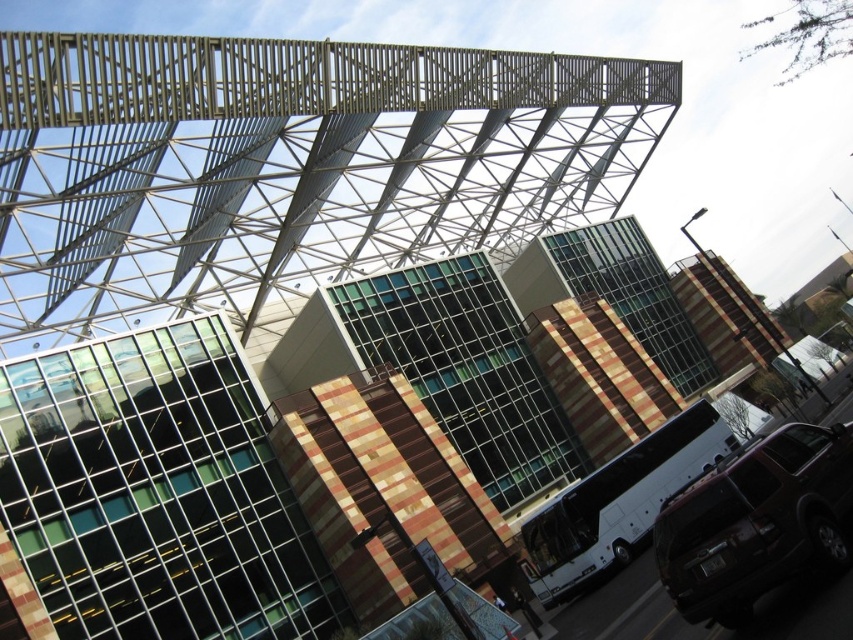
You are a city planner evaluating the parking space requirements for the shiny black suv at lower right and the white metallic bus at center. Based on their sizes, which vehicle would require a larger parking space?

The white metallic bus at center requires a larger parking space since the shiny black suv at lower right is smaller in size compared to it.

You are standing at the center of the image. Which direction should you move to reach the shiny black suv at lower right?

You should move to the lower right direction to reach the shiny black suv at lower right since it is located at point (756, 522).

You are a delivery person trying to park your vehicle in the parking space located between the shiny black suv at lower right and the white metallic bus at center. Which vehicle should you avoid hitting because it is taller?

The white metallic bus at center is taller than the shiny black suv at lower right, so you should avoid hitting the white metallic bus at center to prevent damage due to its greater height.